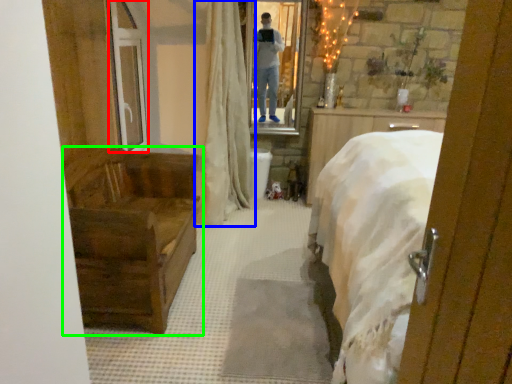
Question: Which object is positioned closest to glass door (highlighted by a red box)? Select from curtain (highlighted by a blue box) and furniture (highlighted by a green box).

Choices:
 (A) curtain
 (B) furniture

Answer: (A)